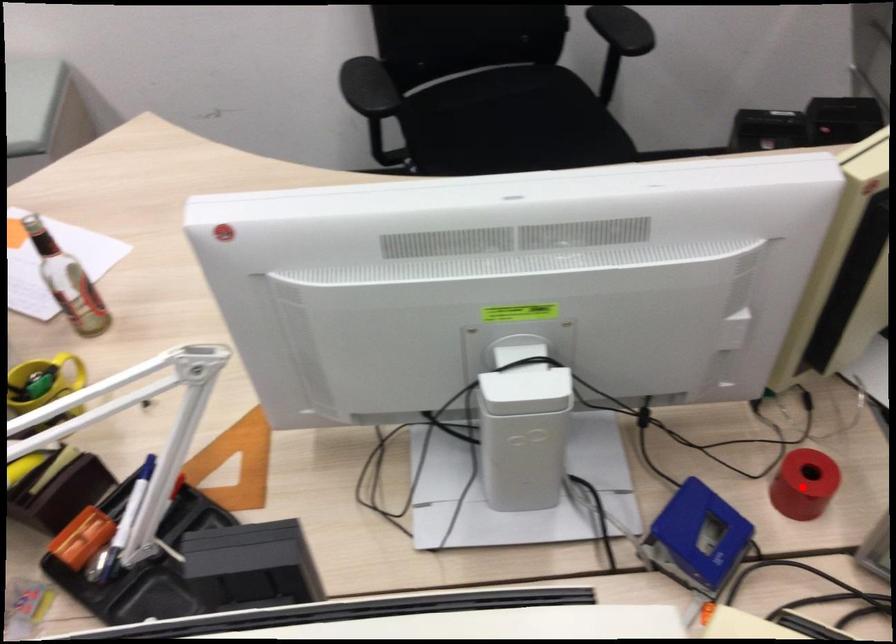
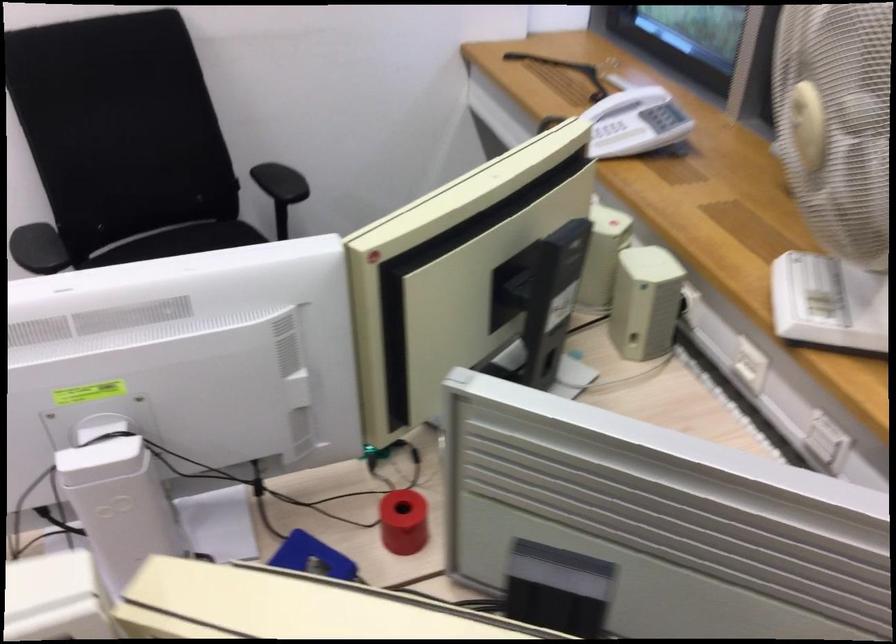
Question: I am providing you with two images of the same scene from different viewpoints. In image1, a red point is highlighted. Considering the same 3D point in image2, which of the following is correct?

Choices:
 (A) It is closer
 (B) It is farther

Answer: (B)